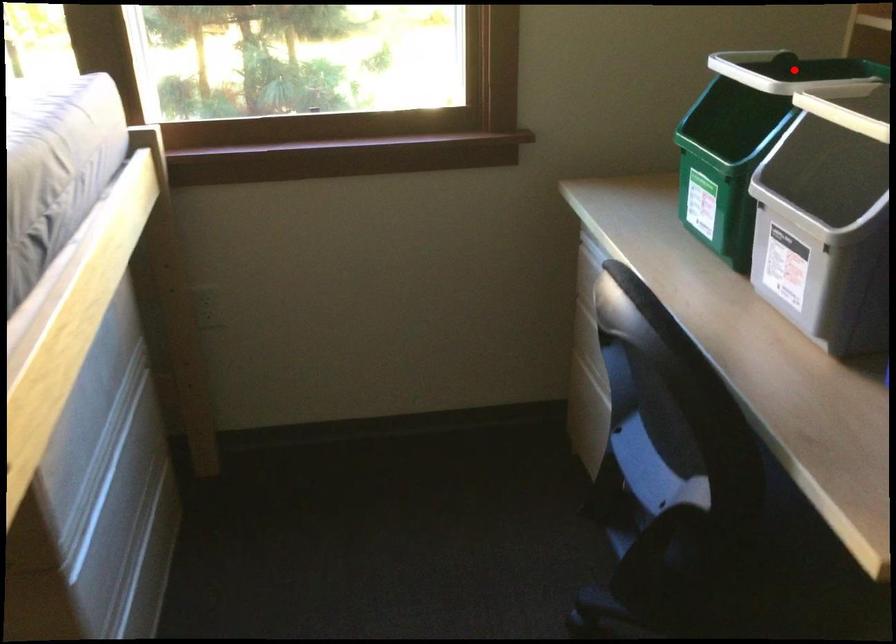
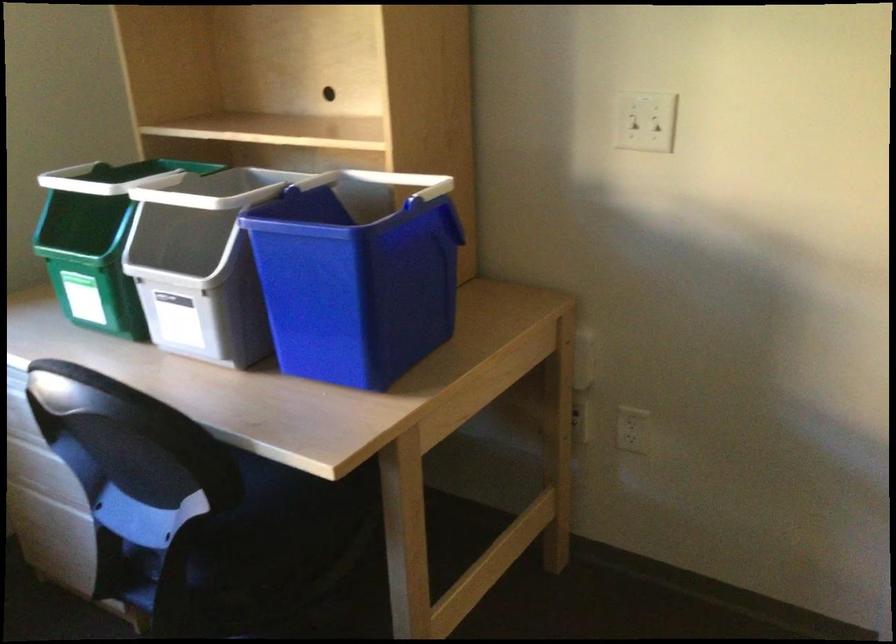
In the second image, find the point that corresponds to the highlighted location in the first image.

(116, 178)